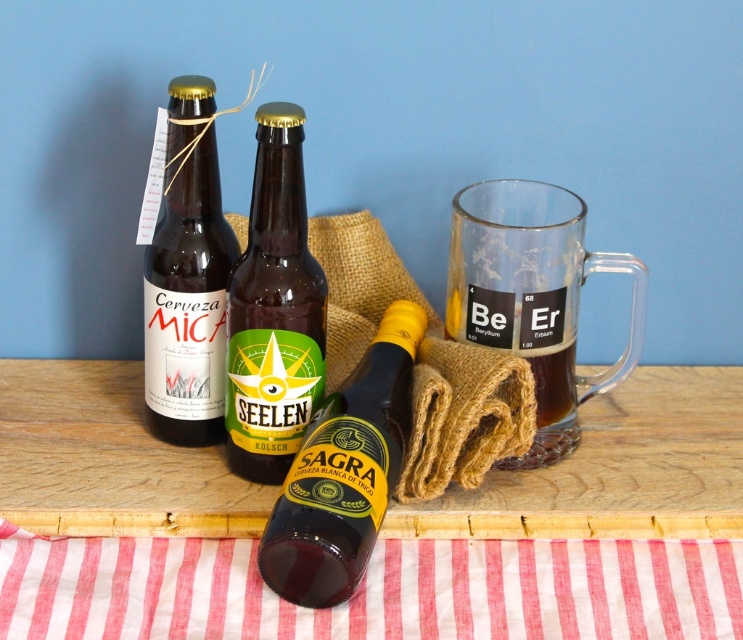
Between red striped fabric at lower center and transparent glass mug at right, which one appears on the left side from the viewer's perspective?

red striped fabric at lower center is more to the left.

Who is more distant from viewer, (640, 616) or (470, 288)?

The point (470, 288) is behind.

At what (x,y) coordinates should I click in order to perform the action: click on red striped fabric at lower center. Please return your answer as a coordinate pair (x, y). Looking at the image, I should click on (372, 589).

The height and width of the screenshot is (640, 743). What do you see at coordinates (533, 298) in the screenshot?
I see `transparent glass mug at right` at bounding box center [533, 298].

Is transparent glass mug at right positioned at the back of matte glass bottle at upper left?

Yes, transparent glass mug at right is further from the viewer.

Does point (467, 305) lie in front of point (189, 291)?

That is False.

Find the location of `transparent glass mug at right`. transparent glass mug at right is located at coordinates (533, 298).

Does shiny brown bottle at center come in front of green matte bottle at center?

Yes, it is in front of green matte bottle at center.

Which is in front, point (296, 556) or point (256, 448)?

Point (296, 556)

This screenshot has height=640, width=743. Find the location of `shiny brown bottle at center`. shiny brown bottle at center is located at coordinates (343, 472).